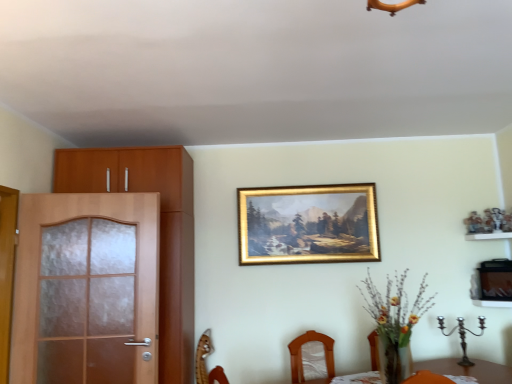
You are a GUI agent. You are given a task and a screenshot of the screen. Output one action in this format:
    pyautogui.click(x=<x>, y=<y>)
    Task: Click on the wooden chair at lower center
    This screenshot has width=512, height=384.
    Given the screenshot: What is the action you would take?
    pyautogui.click(x=205, y=364)

Describe the element at coordinates (205, 364) in the screenshot. This screenshot has height=384, width=512. I see `wooden chair at lower center` at that location.

Measure the distance between point (179, 358) and camera.

A distance of 3.00 meters exists between point (179, 358) and camera.

Image resolution: width=512 pixels, height=384 pixels. What do you see at coordinates (489, 236) in the screenshot?
I see `wooden shelf at right` at bounding box center [489, 236].

Locate an element on the screen. Image resolution: width=512 pixels, height=384 pixels. wooden chair at lower center is located at coordinates (205, 364).

Between brown matte screen door at left and matte wood cabinet at left, which one appears on the right side from the viewer's perspective?

matte wood cabinet at left.

From the image's perspective, is brown matte screen door at left located beneath matte wood cabinet at left?

Correct, brown matte screen door at left appears lower than matte wood cabinet at left in the image.

Which is behind, brown matte screen door at left or matte wood cabinet at left?

matte wood cabinet at left is behind.

How much distance is there between gold/gilded picture frame at upper center and wooden shelf at right?

A distance of 1.25 meters exists between gold/gilded picture frame at upper center and wooden shelf at right.

Is gold/gilded picture frame at upper center far away from wooden shelf at right?

Yes.

Is gold/gilded picture frame at upper center turned away from wooden shelf at right?

No, gold/gilded picture frame at upper center's orientation is not away from wooden shelf at right.

In terms of width, does gold/gilded picture frame at upper center look wider or thinner when compared to wooden shelf at right?

Clearly, gold/gilded picture frame at upper center has less width compared to wooden shelf at right.

Can we say wooden chair at lower center lies outside brown matte screen door at left?

Indeed, wooden chair at lower center is completely outside brown matte screen door at left.

Which object is wider, wooden chair at lower center or brown matte screen door at left?

Wider between the two is brown matte screen door at left.

Is wooden chair at lower center oriented towards brown matte screen door at left?

No, wooden chair at lower center is not facing towards brown matte screen door at left.

Is wooden chair at lower center turned away from wooden shelf at right?

No, wooden chair at lower center is not facing away from wooden shelf at right.

Between wooden chair at lower center and wooden shelf at right, which one has smaller width?

wooden chair at lower center.

Is wooden chair at lower center in contact with wooden shelf at right?

wooden chair at lower center and wooden shelf at right are not in contact.

What's the angular difference between wooden chair at lower center and wooden shelf at right's facing directions?

130 degrees.

Is wooden chair at lower center bigger or smaller than matte wood cabinet at left?

Considering their sizes, wooden chair at lower center takes up less space than matte wood cabinet at left.

At what (x,y) coordinates should I click in order to perform the action: click on cabinetry above the wooden chair at lower center (from a real-world perspective). Please return your answer as a coordinate pair (x, y). Looking at the image, I should click on (160, 232).

Is wooden chair at lower center shorter than matte wood cabinet at left?

Yes, wooden chair at lower center is shorter than matte wood cabinet at left.

How many degrees apart are the facing directions of wooden chair at lower center and matte wood cabinet at left?

wooden chair at lower center and matte wood cabinet at left are facing 36.8 degrees away from each other.

In the scene shown: Is matte wood cabinet at left a part of wooden shelf at right?

No, matte wood cabinet at left is not a part of wooden shelf at right.

Does wooden shelf at right appear on the left side of matte wood cabinet at left?

No, wooden shelf at right is not to the left of matte wood cabinet at left.

Locate an element on the screen. shelf lying on the right of matte wood cabinet at left is located at coordinates (489, 236).

Visually, is wooden chair at lower center positioned to the left or to the right of gold/gilded picture frame at upper center?

wooden chair at lower center is positioned on gold/gilded picture frame at upper center's left side.

Considering the relative sizes of wooden chair at lower center and gold/gilded picture frame at upper center in the image provided, is wooden chair at lower center bigger than gold/gilded picture frame at upper center?

Actually, wooden chair at lower center might be smaller than gold/gilded picture frame at upper center.

Based on the photo, is wooden chair at lower center wider or thinner than gold/gilded picture frame at upper center?

Clearly, wooden chair at lower center has more width compared to gold/gilded picture frame at upper center.

Is wooden chair at lower center not near gold/gilded picture frame at upper center?

Yes, wooden chair at lower center and gold/gilded picture frame at upper center are quite far apart.

You are a GUI agent. You are given a task and a screenshot of the screen. Output one action in this format:
    pyautogui.click(x=<x>, y=<y>)
    Task: Click on the cabinetry that is above the brown matte screen door at left (from a real-world perspective)
    This screenshot has height=384, width=512.
    Given the screenshot: What is the action you would take?
    pyautogui.click(x=160, y=232)

The image size is (512, 384). I want to click on picture frame above the wooden shelf at right (from the image's perspective), so click(x=308, y=224).

Consider the image. From the image, which object appears to be farther from wooden shelf at right, brown matte screen door at left or gold/gilded picture frame at upper center?

brown matte screen door at left is further to wooden shelf at right.

From the image, which object appears to be nearer to wooden shelf at right, wooden chair at lower center or brown matte screen door at left?

wooden chair at lower center.

When comparing their distances from matte wood cabinet at left, does gold/gilded picture frame at upper center or brown matte screen door at left seem closer?

The object closer to matte wood cabinet at left is brown matte screen door at left.

From the image, which object appears to be farther from matte wood cabinet at left, wooden shelf at right or wooden chair at lower center?

wooden shelf at right.

Based on their spatial positions, is gold/gilded picture frame at upper center or matte wood cabinet at left further from brown matte screen door at left?

gold/gilded picture frame at upper center lies further to brown matte screen door at left than the other object.

When comparing their distances from matte wood cabinet at left, does gold/gilded picture frame at upper center or wooden chair at lower center seem closer?

wooden chair at lower center.

Looking at the image, which one is located closer to wooden shelf at right, matte wood cabinet at left or brown matte screen door at left?

Among the two, matte wood cabinet at left is located nearer to wooden shelf at right.

From the image, which object appears to be nearer to gold/gilded picture frame at upper center, brown matte screen door at left or wooden shelf at right?

Among the two, wooden shelf at right is located nearer to gold/gilded picture frame at upper center.

Where is `chair between brown matte screen door at left and gold/gilded picture frame at upper center`? chair between brown matte screen door at left and gold/gilded picture frame at upper center is located at coordinates (205, 364).

The image size is (512, 384). Identify the location of chair between brown matte screen door at left and wooden shelf at right. (205, 364).

I want to click on chair situated between matte wood cabinet at left and wooden shelf at right from left to right, so click(x=205, y=364).

This screenshot has width=512, height=384. In order to click on cabinetry located between brown matte screen door at left and gold/gilded picture frame at upper center in the left-right direction in this screenshot , I will do `click(160, 232)`.